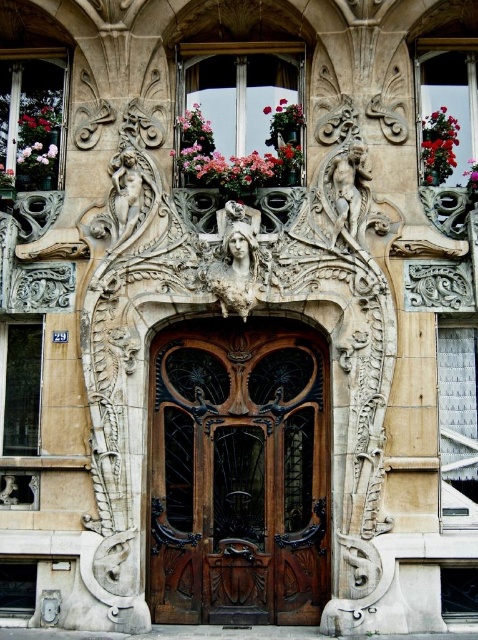
You are an architect designing a new building and want to ensure that the pink matte flower at center is positioned in a way that it doesn not block the view of the matte gray metal window at lower left. Based on their sizes, is this feasible?

The matte gray metal window at lower left might be wider than pink matte flower at center, so it is possible to position the pink matte flower at center without blocking the view of the matte gray metal window at lower left, provided they are placed appropriately considering their widths.

You are standing in front of the entrance and want to touch both points on the door frame. Which point should you reach for first, the point at coordinate (x=476, y=468) or the point at coordinate (x=237, y=296)?

You should reach for the point at coordinate (x=476, y=468) first because it is closer to you than the point at coordinate (x=237, y=296), which is further away.

You are an architect analyzing the entrance of a historic building. You notice a clear glass window at center. Can you determine its exact location in terms of coordinates?

The clear glass window at center is located at coordinates point (457, 424).